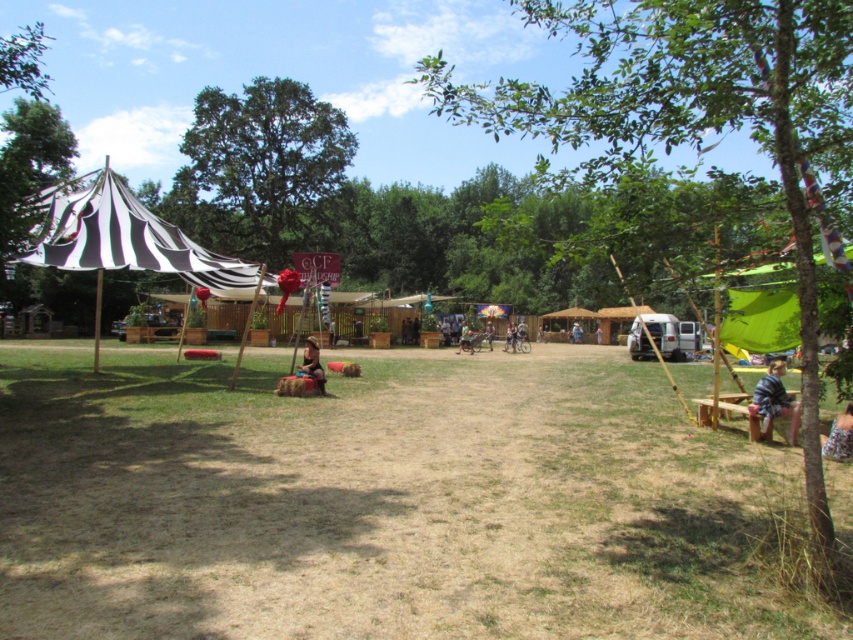
You are a photographer trying to capture the entire scene of the festival. You notice the green leafy tree at center right and the blue denim shorts at center. Which object might block your view if you position your camera too close to the ground?

The green leafy tree at center right might block your view because it is wider than the blue denim shorts at center, so positioning the camera too close to the ground could obscure the tree in the frame.

You are standing in the festival area and want to take a photo of the green leafy tree at center right. If your camera can focus on objects up to 4 meters away, will you need to move closer or farther away to capture the tree clearly?

The green leafy tree at center right is 4.11 meters away from the viewer. Since your camera can focus up to 4 meters, you need to move slightly closer to ensure the tree is within the camera range.

Looking at this image, you are standing at the center of the grassy area in the festival scene. You want to sit down on the brown fabric cushion located at point (305, 372). However, there is a small debris pile 0.1 units away from the cushion. Can you safely step over the debris to reach the cushion without getting too close?

The brown fabric cushion at center is located at point (305, 372). Since the debris is only 0.1 units away, you can safely step over it to reach the cushion without getting too close.